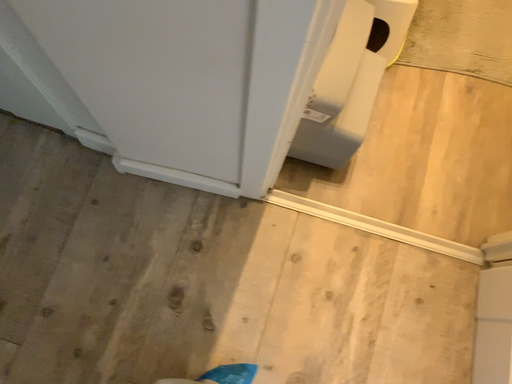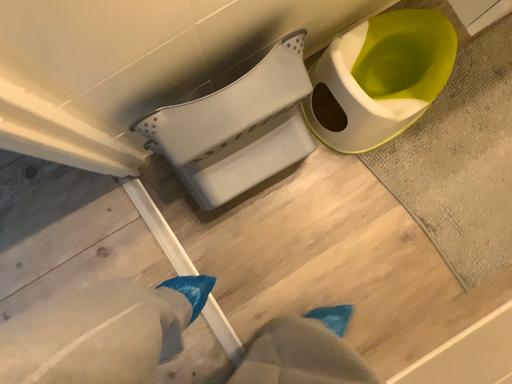
Question: How did the camera likely rotate when shooting the video?

Choices:
 (A) rotated right
 (B) rotated left

Answer: (B)